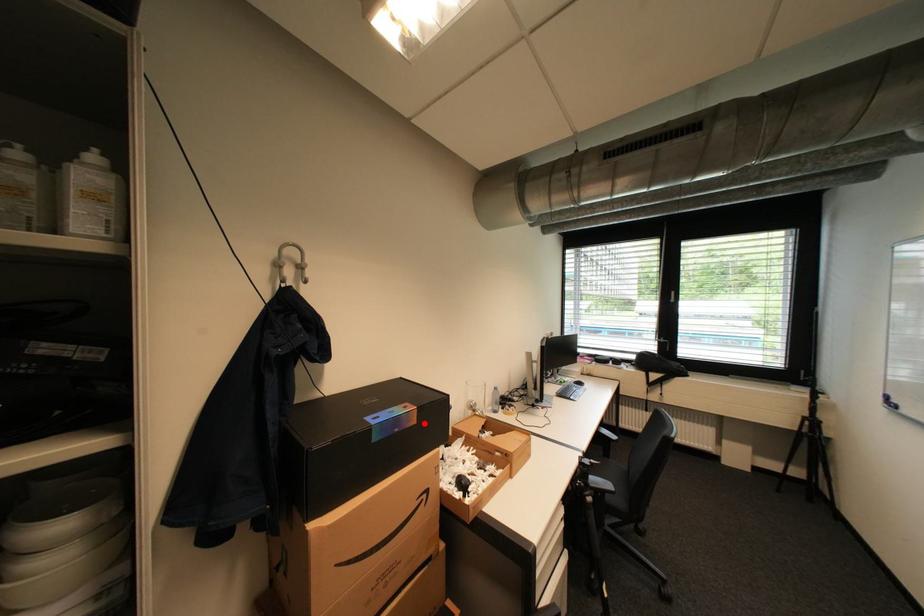
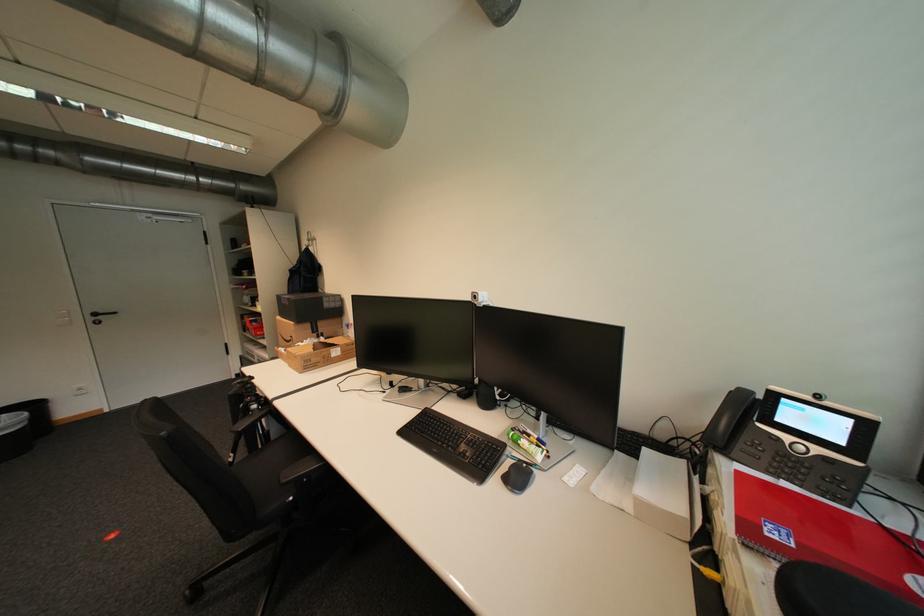
Locate, in the second image, the point that corresponds to the highlighted location in the first image.

(296, 305)